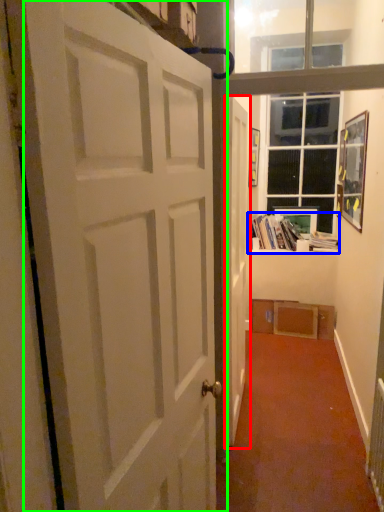
Question: Based on their relative distances, which object is farther from door (highlighted by a red box)? Choose from book (highlighted by a blue box) and door (highlighted by a green box).

Choices:
 (A) book
 (B) door

Answer: (A)